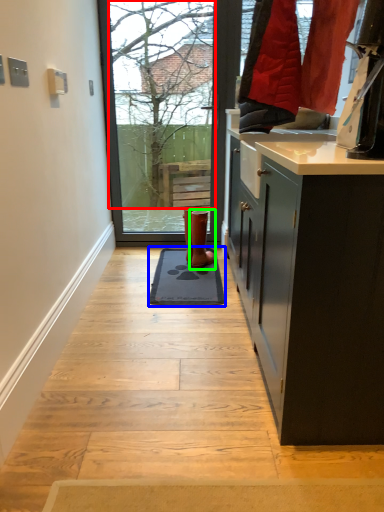
Question: Which object is the farthest from tree (highlighted by a red box)? Choose among these: doormat (highlighted by a blue box) or footwear (highlighted by a green box).

Choices:
 (A) doormat
 (B) footwear

Answer: (A)